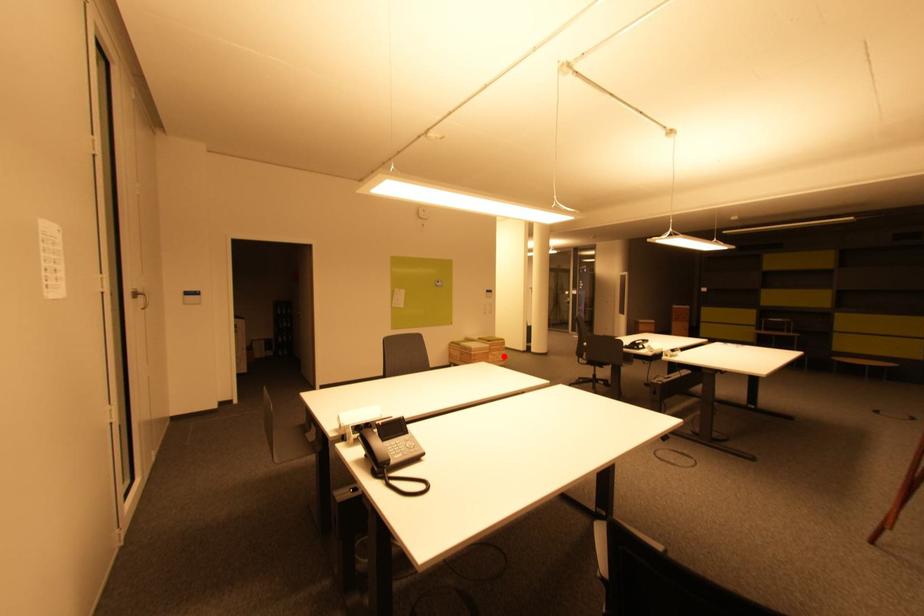
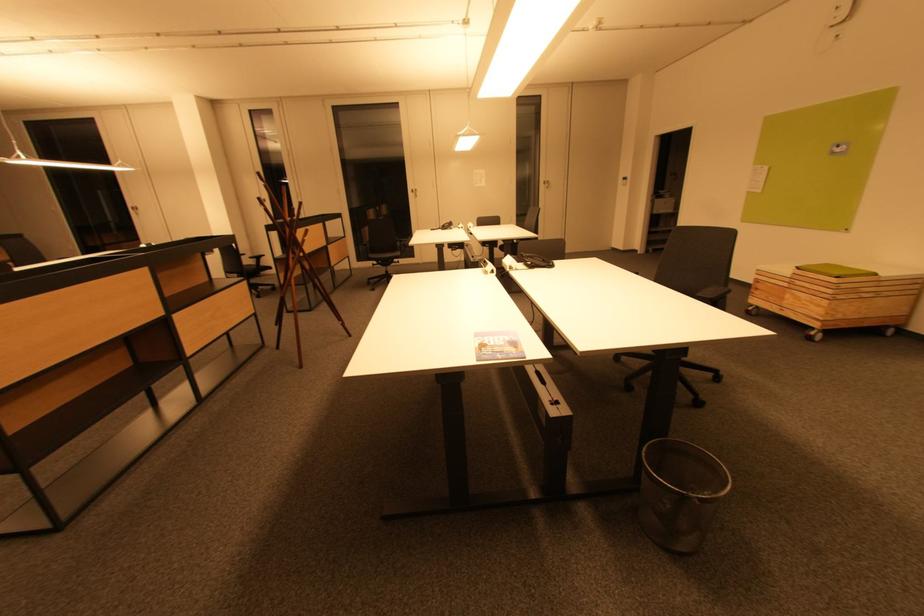
Question: I am providing you with two images of the same scene from different viewpoints. Image1 has a red point marked. In image2, the corresponding 3D location appears at what relative position? Reply with the corresponding letter.

Choices:
 (A) Closer
 (B) Farther

Answer: (A)